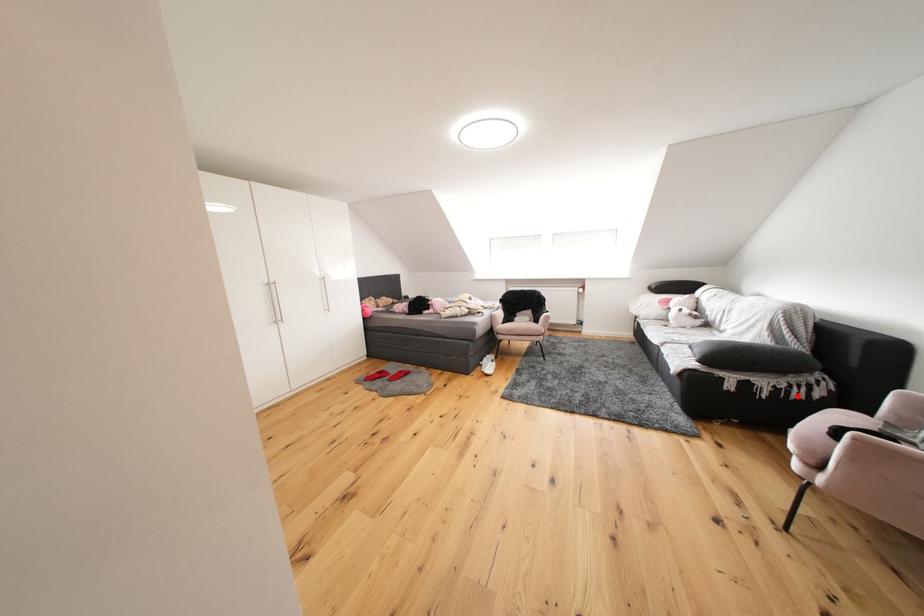
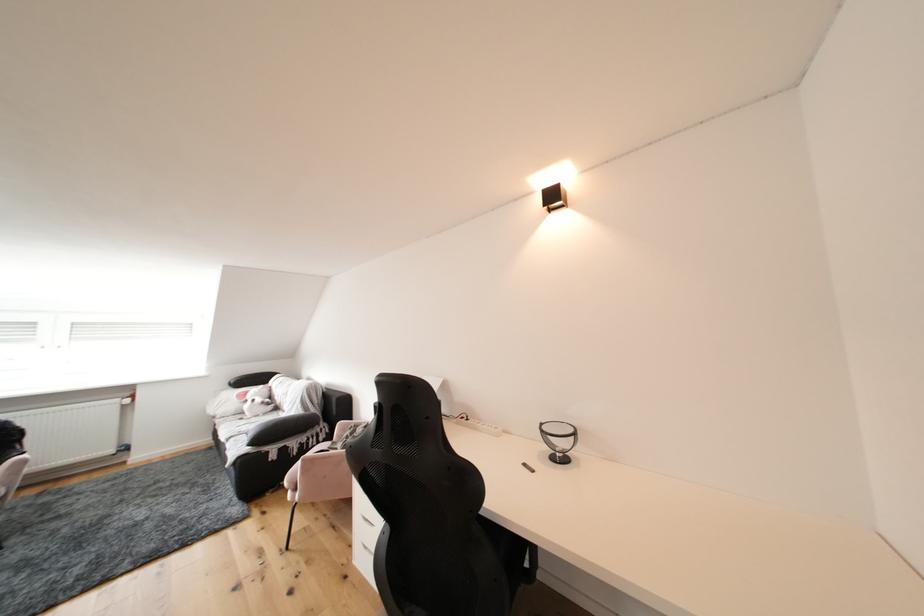
In the second image, find the point that corresponds to the highlighted location in the first image.

(317, 447)